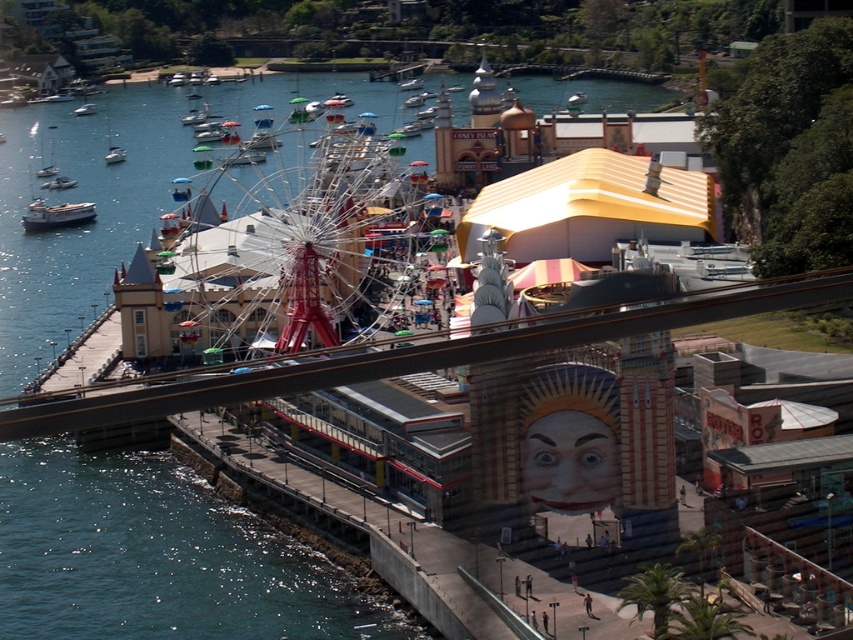
Question: Which of the following is the closest to the observer?

Choices:
 (A) white plastic boat at lower left
 (B) white matte boat at left
 (C) white metallic ferris wheel at center

Answer: (C)

Question: From the image, what is the correct spatial relationship of white matte boat at left in relation to white plastic boat at lower left?

Choices:
 (A) left
 (B) right

Answer: (B)

Question: Is the position of white metallic ferris wheel at center less distant than that of white matte boat at left?

Choices:
 (A) yes
 (B) no

Answer: (A)

Question: Which object is positioned closest to the white plastic boat at lower left?

Choices:
 (A) white matte boat at left
 (B) white metallic ferris wheel at center

Answer: (A)

Question: Is white metallic ferris wheel at center thinner than white plastic boat at lower left?

Choices:
 (A) no
 (B) yes

Answer: (A)

Question: Which object appears farthest from the camera in this image?

Choices:
 (A) white metallic ferris wheel at center
 (B) white plastic boat at lower left
 (C) white matte boat at left

Answer: (B)